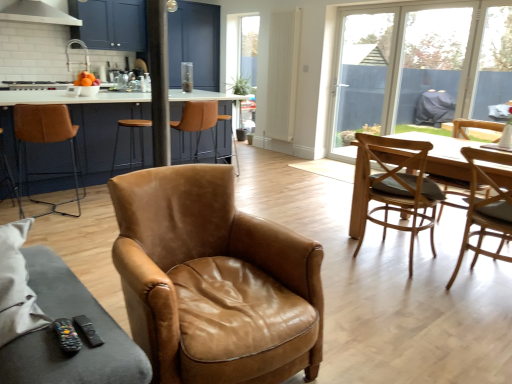
Question: Is white glossy exhaust hood at upper left to the left of transparent glass window at upper right, positioned as the first window screen in right-to-left order, from the viewer's perspective?

Choices:
 (A) yes
 (B) no

Answer: (A)

Question: Is white glossy exhaust hood at upper left bigger than transparent glass window at upper right, positioned as the first window screen in right-to-left order?

Choices:
 (A) yes
 (B) no

Answer: (A)

Question: Could transparent glass window at upper right, positioned as the first window screen in right-to-left order, be considered to be inside white glossy exhaust hood at upper left?

Choices:
 (A) no
 (B) yes

Answer: (A)

Question: From a real-world perspective, is white glossy exhaust hood at upper left over transparent glass window at upper right, the third window screen when ordered from left to right?

Choices:
 (A) yes
 (B) no

Answer: (A)

Question: Can you confirm if white glossy exhaust hood at upper left is smaller than transparent glass window at upper right, positioned as the first window screen in right-to-left order?

Choices:
 (A) yes
 (B) no

Answer: (B)

Question: From the image's perspective, is white glossy exhaust hood at upper left below transparent glass window at upper right, the third window screen when ordered from left to right?

Choices:
 (A) yes
 (B) no

Answer: (B)

Question: Can you confirm if transparent glass door at center, the 3th window screen in the right-to-left sequence, is positioned to the right of transparent plastic window screen at right, the 2th window screen positioned from the left?

Choices:
 (A) no
 (B) yes

Answer: (A)

Question: Could you tell me if transparent glass door at center, which is the 1th window screen in left-to-right order, is turned towards transparent plastic window screen at right, the 2th window screen positioned from the left?

Choices:
 (A) no
 (B) yes

Answer: (A)

Question: Is transparent glass door at center, which is the 1th window screen in left-to-right order, bigger than transparent plastic window screen at right, the second window screen in the right-to-left sequence?

Choices:
 (A) no
 (B) yes

Answer: (B)

Question: Is transparent glass door at center, which is the 1th window screen in left-to-right order, not inside transparent plastic window screen at right, the 2th window screen positioned from the left?

Choices:
 (A) yes
 (B) no

Answer: (A)

Question: Is transparent glass door at center, which is the 1th window screen in left-to-right order, smaller than transparent plastic window screen at right, the 2th window screen positioned from the left?

Choices:
 (A) yes
 (B) no

Answer: (B)

Question: Is transparent glass door at center, which is the 1th window screen in left-to-right order, at the left side of transparent plastic window screen at right, the 2th window screen positioned from the left?

Choices:
 (A) no
 (B) yes

Answer: (B)

Question: Can you confirm if light brown wooden chair at right, the 4th chair from the left, is bigger than black plastic remote at lower left?

Choices:
 (A) no
 (B) yes

Answer: (B)